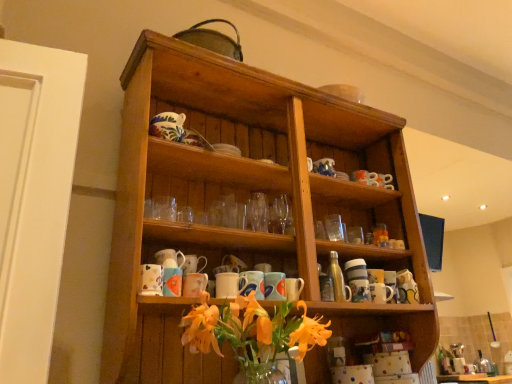
Question: Is matte ceramic mug at center, acting as the sixth mug starting from the left, not within matte ceramic mug at center, which appears as the 6th mug when viewed from the right?

Choices:
 (A) yes
 (B) no

Answer: (A)

Question: Can you confirm if matte ceramic mug at center, the second mug positioned from the right, is shorter than matte ceramic mug at center, which appears as the 6th mug when viewed from the right?

Choices:
 (A) yes
 (B) no

Answer: (B)

Question: Is matte ceramic mug at center, the second mug positioned from the right, wider than matte ceramic mug at center, which appears as the second mug when viewed from the left?

Choices:
 (A) no
 (B) yes

Answer: (B)

Question: Does matte ceramic mug at center, acting as the sixth mug starting from the left, have a greater height compared to matte ceramic mug at center, which appears as the 6th mug when viewed from the right?

Choices:
 (A) no
 (B) yes

Answer: (B)

Question: From the image's perspective, does matte ceramic mug at center, the second mug positioned from the right, appear higher than matte ceramic mug at center, which appears as the second mug when viewed from the left?

Choices:
 (A) yes
 (B) no

Answer: (B)

Question: Considering their positions, is matte ceramic mug at center, placed as the 5th mug when sorted from right to left, located in front of or behind matte ceramic mug at center, which appears as the second mug when viewed from the left?

Choices:
 (A) front
 (B) behind

Answer: (B)

Question: Do you think matte ceramic mug at center, placed as the 5th mug when sorted from right to left, is within matte ceramic mug at center, which appears as the 6th mug when viewed from the right, or outside of it?

Choices:
 (A) inside
 (B) outside

Answer: (B)

Question: Is matte ceramic mug at center, placed as the third mug when sorted from left to right, wider or thinner than matte ceramic mug at center, which appears as the second mug when viewed from the left?

Choices:
 (A) wide
 (B) thin

Answer: (A)

Question: From a real-world perspective, is matte ceramic mug at center, placed as the 5th mug when sorted from right to left, positioned above or below matte ceramic mug at center, which appears as the 6th mug when viewed from the right?

Choices:
 (A) above
 (B) below

Answer: (A)

Question: Is point (332, 289) closer or farther from the camera than point (203, 283)?

Choices:
 (A) farther
 (B) closer

Answer: (A)

Question: In terms of size, does metallic silver bottle at center-right appear bigger or smaller than matte ceramic mug at center, which appears as the 6th mug when viewed from the right?

Choices:
 (A) big
 (B) small

Answer: (A)

Question: Looking at their shapes, would you say metallic silver bottle at center-right is wider or thinner than matte ceramic mug at center, which appears as the second mug when viewed from the left?

Choices:
 (A) thin
 (B) wide

Answer: (A)

Question: Would you say metallic silver bottle at center-right is to the left or to the right of matte ceramic mug at center, which appears as the 6th mug when viewed from the right, in the picture?

Choices:
 (A) right
 (B) left

Answer: (A)

Question: Is matte ceramic mug at center, arranged as the 4th mug when viewed from the right, to the left or to the right of matte ceramic mug at center, which ranks as the 7th mug in left-to-right order, in the image?

Choices:
 (A) right
 (B) left

Answer: (B)

Question: In terms of size, does matte ceramic mug at center, which is the 4th mug in left-to-right order, appear bigger or smaller than matte ceramic mug at center, which ranks as the 7th mug in left-to-right order?

Choices:
 (A) big
 (B) small

Answer: (B)